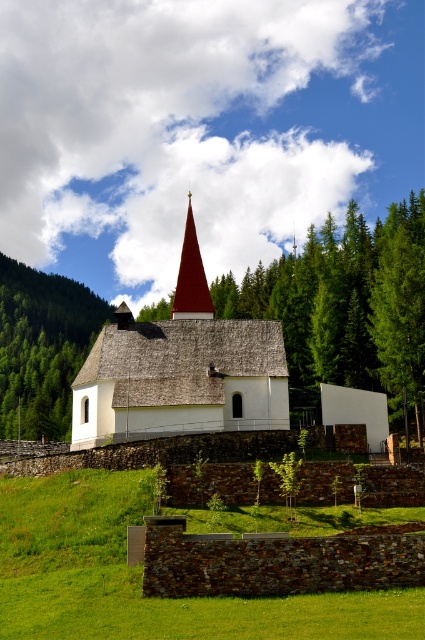
You are standing in front of the church and want to take a photo that includes both the matte red roof at center and the green leafy tree at upper left. Based on their positions, which object should be placed on the right side of your photo frame?

The matte red roof at center should be placed on the right side of your photo frame because it is positioned on the right side of the green leafy tree at upper left.

You are a landscape architect designing a new garden layout around the church. The church has a matte red roof at center and there is a green leafy tree at upper left. Given their widths, which object would require more horizontal space in the garden plan?

The green leafy tree at upper left requires more horizontal space because its width is greater than the matte red roof at center.

Looking at this image, you are standing at the base of the church and looking up. Which object is closer to your eyes, the green grass at lower center or the smooth red spire at center?

The green grass at lower center is closer to your eyes because it is positioned below the smooth red spire at center, which is higher up.